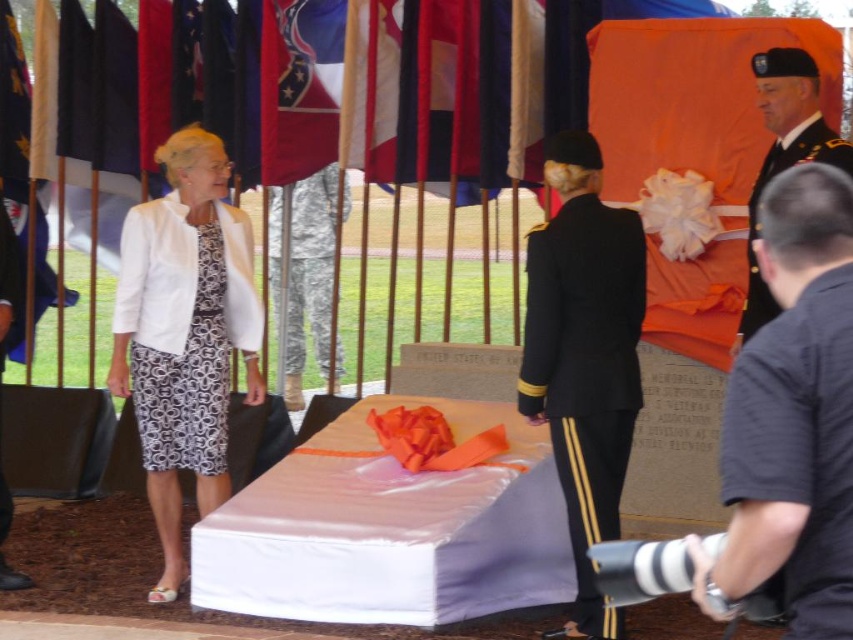
You are a photographer at the ceremony and want to capture a closeup of both point (775,33) and point (210,260) in the scene. Given that your camera can only focus on one plane at a time, which point should you focus on to ensure the closer object is sharp?

You should focus on point 0.058, 0.910 because it is closer to the camera than point (210,260), so focusing there will keep the closer object sharp.